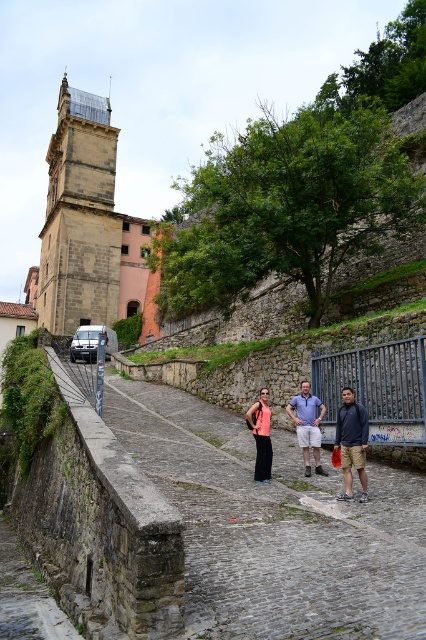
You are standing at the origin point of the coordinate system in this image. You need to locate the dark blue hoodie at center. Which direction should you move to reach it?

The dark blue hoodie at center is located at coordinate point 0.691 on the x axis and 0.826 on the y axis. Since you are at the origin, you should move towards the positive x and positive y direction to reach it.

You are standing at the starting point of the cobblestone path at center. If you walk straight ahead, will you eventually reach the stone wall with the tree near it?

Yes, the cobblestone path at center leads up towards the stone wall with the tree near it, so walking straight ahead will take you there.